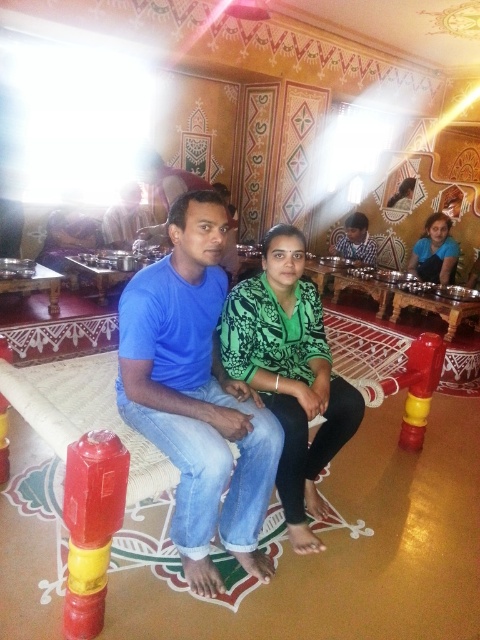
Consider the image. Does blue cotton shirt at center have a lesser width compared to green printed shirt at center?

In fact, blue cotton shirt at center might be wider than green printed shirt at center.

Looking at this image, which is more to the left, blue cotton shirt at center or green printed shirt at center?

blue cotton shirt at center

Who is more forward, (180, 280) or (349, 436)?

Point (180, 280) is more forward.

You are a GUI agent. You are given a task and a screenshot of the screen. Output one action in this format:
    pyautogui.click(x=<x>, y=<y>)
    Task: Click on the blue cotton shirt at center
    The image size is (480, 640).
    Given the screenshot: What is the action you would take?
    pyautogui.click(x=196, y=396)

Between point (261, 378) and point (80, 484), which one is positioned in front?

Point (80, 484) is in front.

Does green printed shirt at center have a greater height compared to red/yellow plastic fire extinguisher at lower left?

Indeed, green printed shirt at center has a greater height compared to red/yellow plastic fire extinguisher at lower left.

What are the coordinates of `green printed shirt at center` in the screenshot? It's located at (289, 372).

Is blue cotton shirt at center taller than matte blue shirt at center?

Yes, blue cotton shirt at center is taller than matte blue shirt at center.

Is blue cotton shirt at center bigger than matte blue shirt at center?

Yes.

You are a GUI agent. You are given a task and a screenshot of the screen. Output one action in this format:
    pyautogui.click(x=<x>, y=<y>)
    Task: Click on the blue cotton shirt at center
    
    Given the screenshot: What is the action you would take?
    pyautogui.click(x=196, y=396)